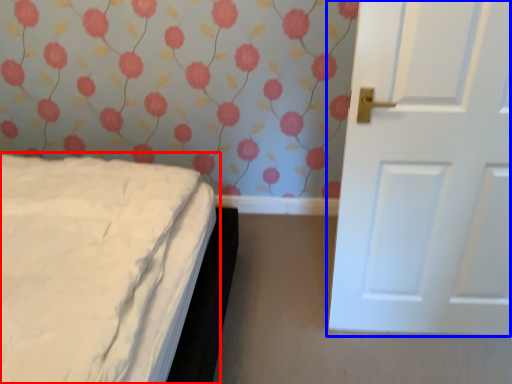
Question: Which object appears farthest to the camera in this image, bed (highlighted by a red box) or door (highlighted by a blue box)?

Choices:
 (A) bed
 (B) door

Answer: (B)